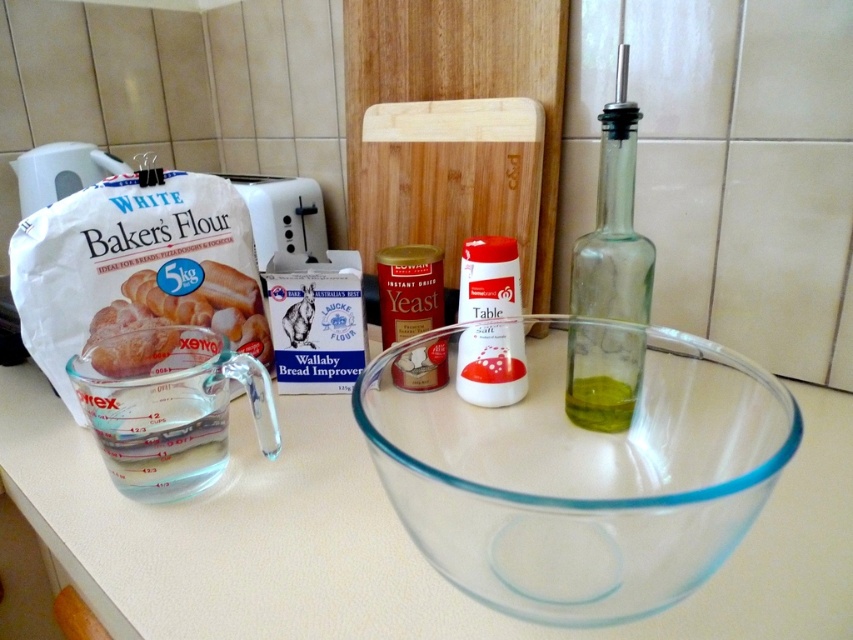
You are a baker trying to locate two specific points on the kitchen countertop. The first point is at coordinate point (689, 452) and the second is at point (579, 420). From your viewpoint, which point is closer to you?

Point (689, 452) is in front of point (579, 420), so it is closer to you.

You are a baker trying to pour liquid from the green glass bottle at right into the transparent glass bowl at center. Can you do this without moving either object?

The transparent glass bowl at center is closer to the viewer than the green glass bottle at right, so yes, you can pour the liquid from the green glass bottle at right into the transparent glass bowl at center without moving either object because the bowl is in front of the bottle.